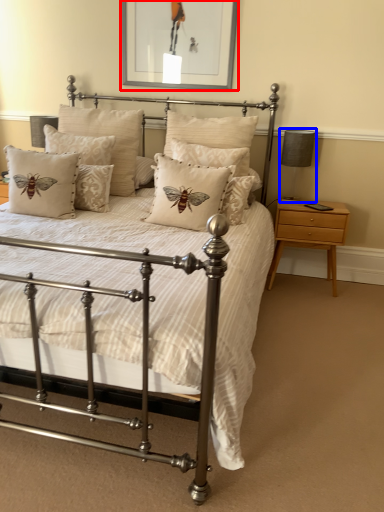
Question: Which point is closer to the camera, picture frame (highlighted by a red box) or table lamp (highlighted by a blue box)?

Choices:
 (A) picture frame
 (B) table lamp

Answer: (A)